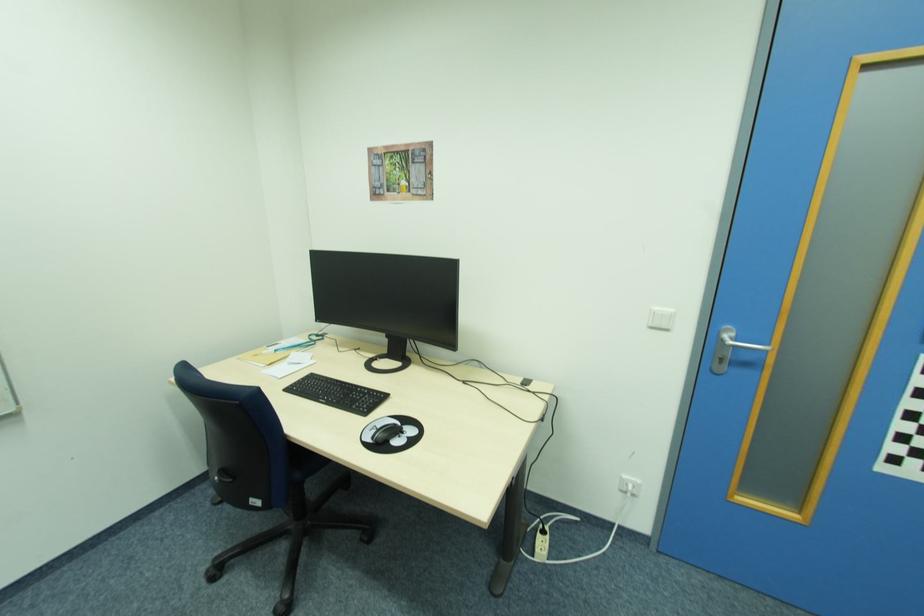
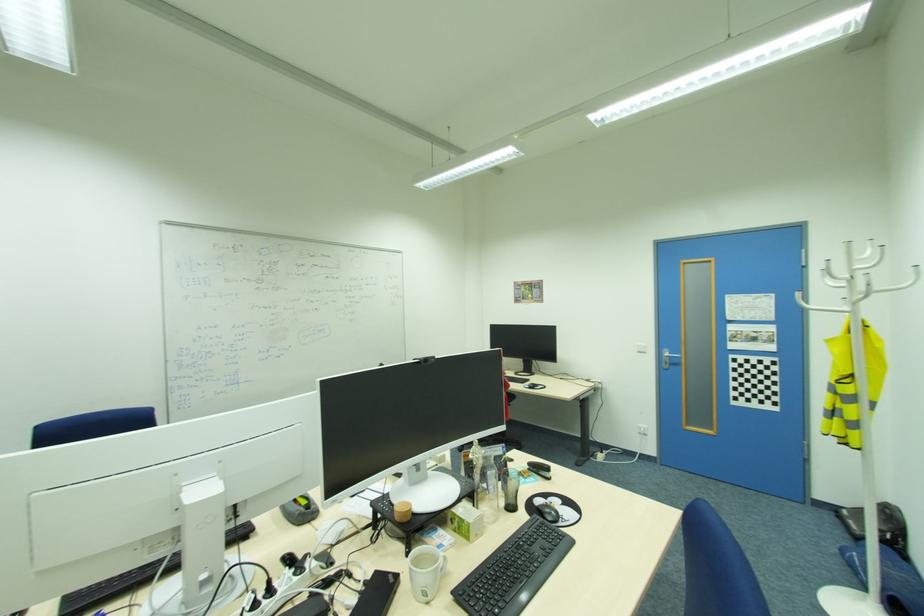
Question: The images are taken continuously from a first-person perspective. In which direction are you moving?

Choices:
 (A) Left
 (B) Right
 (C) Forward
 (D) Backward

Answer: (D)